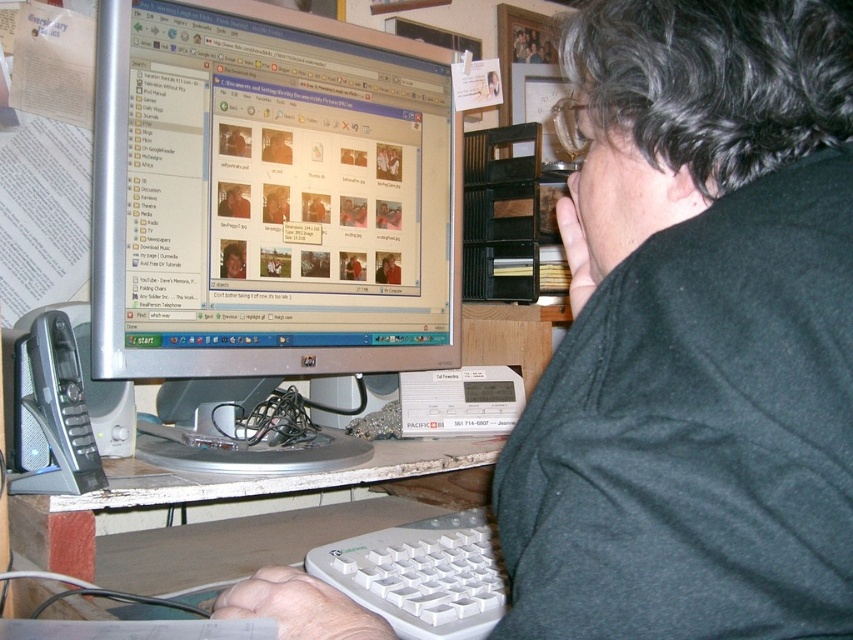
Who is more distant from viewer, (415, 621) or (74, 502)?

Positioned behind is point (74, 502).

Is white plastic keyboard at lower center above white plastic table at lower center?

Incorrect, white plastic keyboard at lower center is not positioned above white plastic table at lower center.

Between point (358, 560) and point (491, 436), which one is positioned behind?

Point (491, 436)

Locate an element on the screen. white plastic keyboard at lower center is located at coordinates (421, 576).

Is silver metallic monitor at center positioned before white plastic table at lower center?

No.

Which of these two, silver metallic monitor at center or white plastic table at lower center, stands taller?

silver metallic monitor at center

Is point (181, 129) positioned after point (492, 440)?

No.

Find the location of a particular element. silver metallic monitor at center is located at coordinates (270, 195).

Is silver metallic monitor at center to the left of white plastic keyboard at lower center from the viewer's perspective?

Correct, you'll find silver metallic monitor at center to the left of white plastic keyboard at lower center.

Can you confirm if silver metallic monitor at center is taller than white plastic keyboard at lower center?

Yes.

Locate an element on the screen. silver metallic monitor at center is located at coordinates (270, 195).

The height and width of the screenshot is (640, 853). I want to click on silver metallic monitor at center, so click(x=270, y=195).